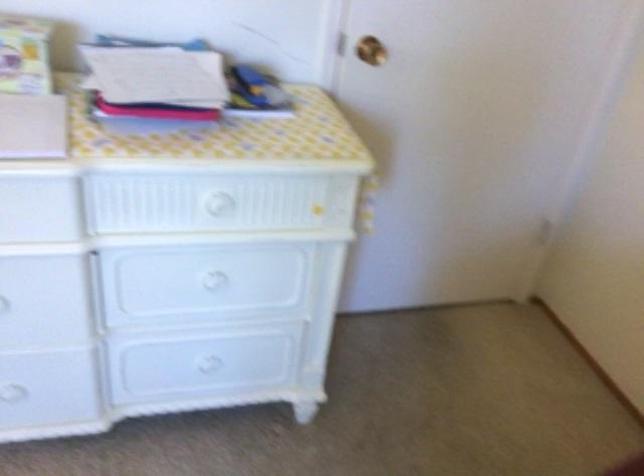
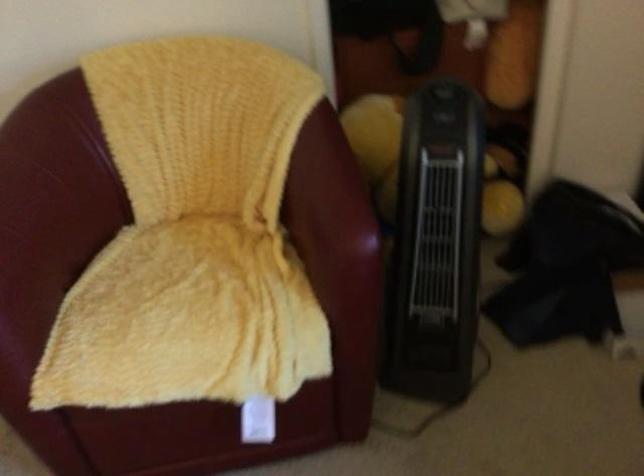
First-person continuous shooting, in which direction is the camera rotating?

The rotation direction of the camera is right-down.